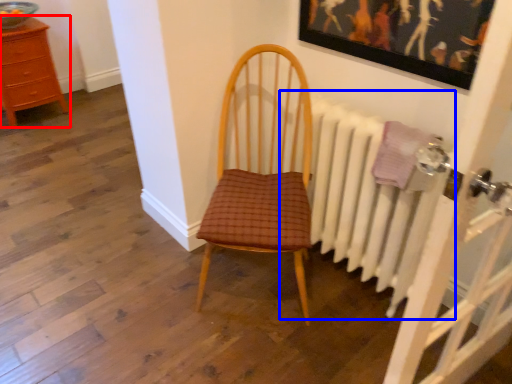
Question: Which point is closer to the camera, chest of drawers (highlighted by a red box) or radiator (highlighted by a blue box)?

Choices:
 (A) chest of drawers
 (B) radiator

Answer: (B)